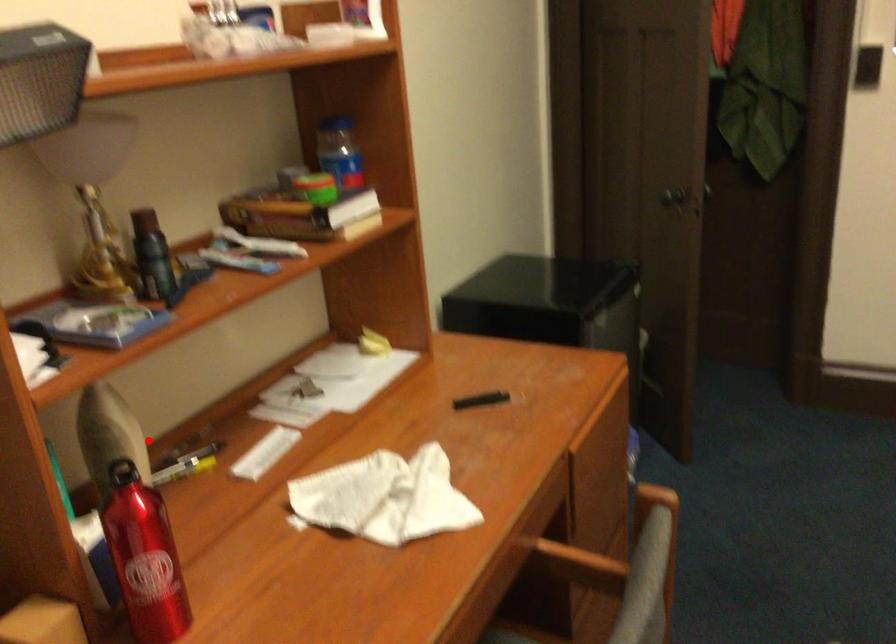
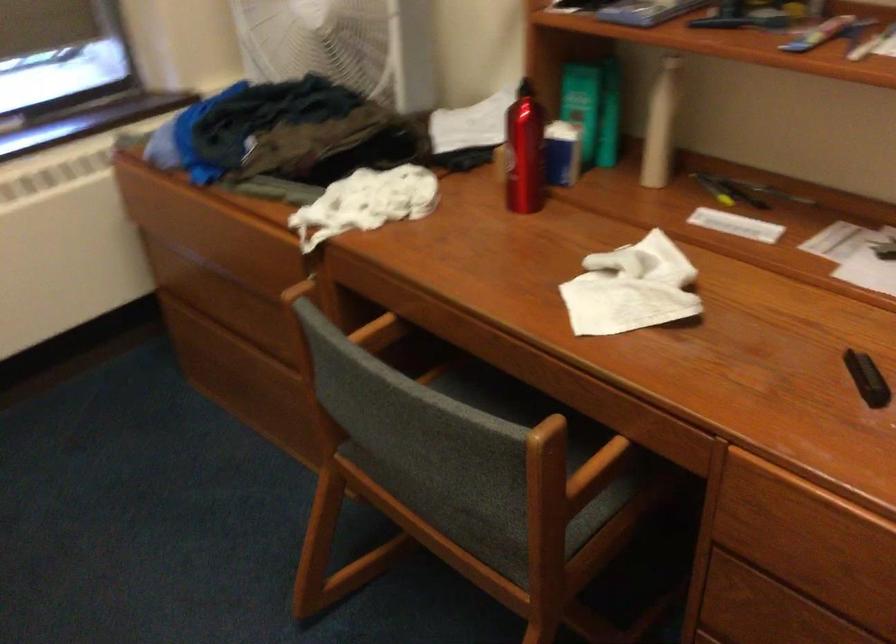
Find the pixel in the second image that matches the highlighted location in the first image.

(659, 125)